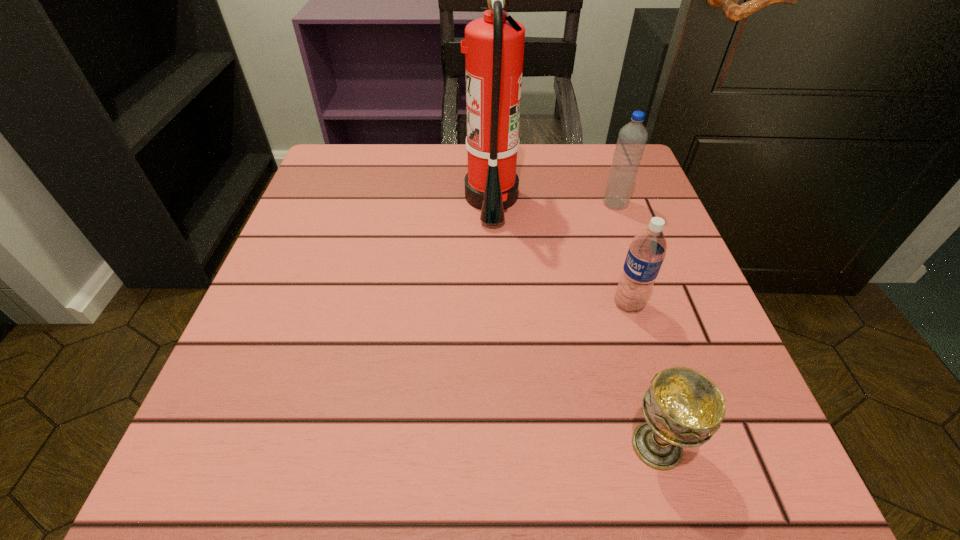
This screenshot has height=540, width=960. Find the location of `the leftmost object`. the leftmost object is located at coordinates (493, 46).

Find the location of a particular element. This screenshot has height=540, width=960. fire extinguisher is located at coordinates (493, 46).

You are a GUI agent. You are given a task and a screenshot of the screen. Output one action in this format:
    pyautogui.click(x=<x>, y=<y>)
    Task: Click on the farther water bottle
    
    Given the screenshot: What is the action you would take?
    pyautogui.click(x=632, y=138)

This screenshot has height=540, width=960. Identify the location of the third farthest object. (646, 253).

At what (x,y) coordinates should I click in order to perform the action: click on the nearest object. Please return your answer as a coordinate pair (x, y). This screenshot has height=540, width=960. Looking at the image, I should click on (683, 408).

This screenshot has height=540, width=960. I want to click on chalice, so click(683, 408).

At what (x,y) coordinates should I click in order to perform the action: click on vacant space located 0.240m at the nozzle of the tallest object. Please return your answer as a coordinate pair (x, y). This screenshot has height=540, width=960. Looking at the image, I should click on (352, 198).

Find the location of a particular element. Image resolution: width=960 pixels, height=540 pixels. free space located 0.110m at the nozzle of the tallest object is located at coordinates click(x=413, y=198).

Where is `vacant space situated at the nozzle of the tallest object`? The image size is (960, 540). vacant space situated at the nozzle of the tallest object is located at coordinates (418, 198).

Where is `vacant point located 0.120m on the back of the farther water bottle`? The height and width of the screenshot is (540, 960). vacant point located 0.120m on the back of the farther water bottle is located at coordinates (602, 166).